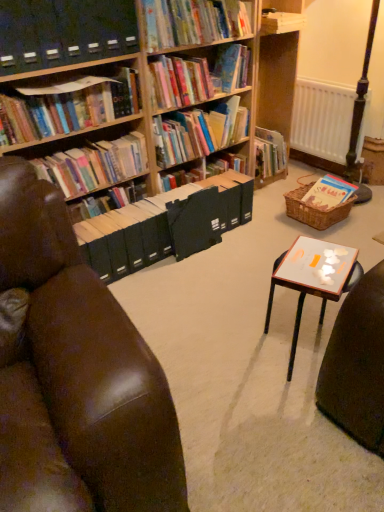
The height and width of the screenshot is (512, 384). I want to click on vacant space in front of white glossy table at center, so click(x=290, y=433).